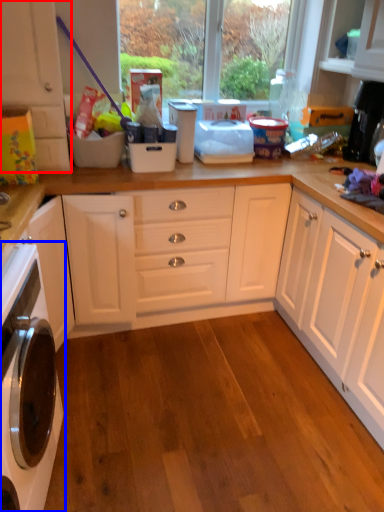
Question: Which of the following is the closest to the observer, cabinetry (highlighted by a red box) or home appliance (highlighted by a blue box)?

Choices:
 (A) cabinetry
 (B) home appliance

Answer: (B)